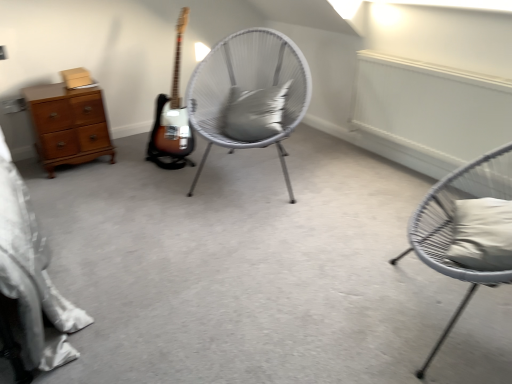
Question: Is gray matte pillow at center, which is the 1th pillow from left to right, located outside matte gray chair at right, placed as the first chair when sorted from right to left?

Choices:
 (A) no
 (B) yes

Answer: (B)

Question: Does gray matte pillow at center, the second pillow viewed from the front, have a smaller size compared to matte gray chair at right, placed as the first chair when sorted from right to left?

Choices:
 (A) yes
 (B) no

Answer: (A)

Question: Considering the relative positions of gray matte pillow at center, which is counted as the second pillow, starting from the bottom, and matte gray chair at right, the 1th chair viewed from the front, in the image provided, is gray matte pillow at center, which is counted as the second pillow, starting from the bottom, to the left of matte gray chair at right, the 1th chair viewed from the front, from the viewer's perspective?

Choices:
 (A) no
 (B) yes

Answer: (B)

Question: From a real-world perspective, is gray matte pillow at center, arranged as the 1th pillow when viewed from the back, physically below matte gray chair at right, the 1th chair viewed from the front?

Choices:
 (A) no
 (B) yes

Answer: (A)

Question: Is gray matte pillow at center, which is the 1th pillow from left to right, facing away from matte gray chair at right, placed as the first chair when sorted from right to left?

Choices:
 (A) no
 (B) yes

Answer: (A)

Question: Is point (244, 76) closer or farther from the camera than point (472, 251)?

Choices:
 (A) farther
 (B) closer

Answer: (A)

Question: From a real-world perspective, is white wicker chair at center, which ranks as the first chair in left-to-right order, positioned above or below white fabric pillow at right, the second pillow viewed from the left?

Choices:
 (A) above
 (B) below

Answer: (B)

Question: Is white wicker chair at center, which ranks as the first chair in left-to-right order, spatially inside white fabric pillow at right, which ranks as the 1th pillow in right-to-left order, or outside of it?

Choices:
 (A) outside
 (B) inside

Answer: (A)

Question: Considering the relative positions of white wicker chair at center, which is the 1th chair from back to front, and white fabric pillow at right, the second pillow viewed from the top, in the image provided, is white wicker chair at center, which is the 1th chair from back to front, to the left or to the right of white fabric pillow at right, the second pillow viewed from the top,?

Choices:
 (A) left
 (B) right

Answer: (A)

Question: Is white fabric pillow at right, which ranks as the 1th pillow in right-to-left order, wider or thinner than white wicker chair at center, which ranks as the first chair in left-to-right order?

Choices:
 (A) thin
 (B) wide

Answer: (A)

Question: From the image's perspective, is white fabric pillow at right, the second pillow viewed from the top, above or below white wicker chair at center, which is the 1th chair from back to front?

Choices:
 (A) below
 (B) above

Answer: (A)

Question: Is white fabric pillow at right, the 2th pillow positioned from the back, inside or outside of white wicker chair at center, the second chair from the right?

Choices:
 (A) outside
 (B) inside

Answer: (A)

Question: From a real-world perspective, is white fabric pillow at right, the second pillow viewed from the top, physically located above or below white wicker chair at center, which is the 1th chair from back to front?

Choices:
 (A) below
 (B) above

Answer: (B)

Question: Visually, is white wicker chair at center, positioned as the 2th chair in front-to-back order, positioned to the left or to the right of matte gray chair at right, which is the 2th chair in left-to-right order?

Choices:
 (A) left
 (B) right

Answer: (A)

Question: Considering their positions, is white wicker chair at center, positioned as the 2th chair in front-to-back order, located in front of or behind matte gray chair at right, the 2th chair viewed from the back?

Choices:
 (A) behind
 (B) front

Answer: (A)